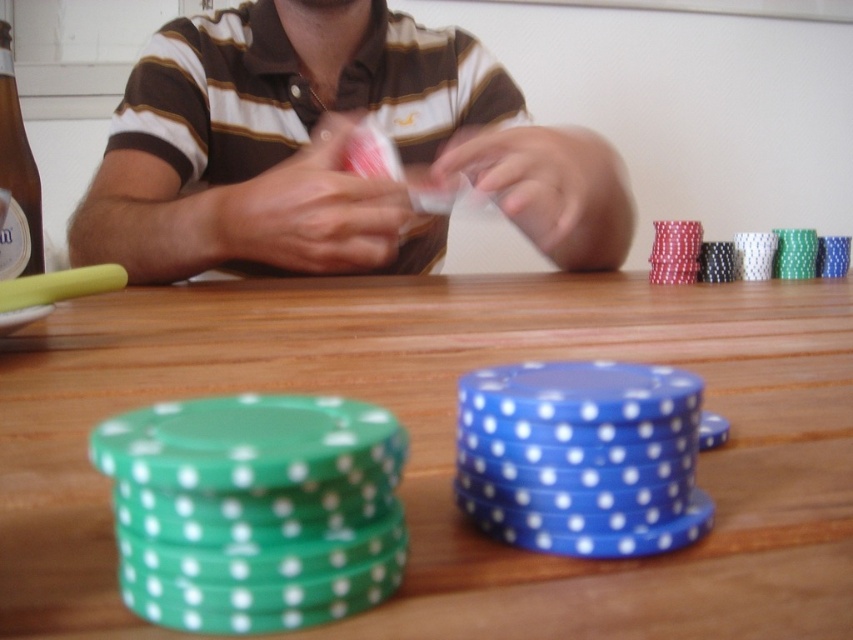
Is green plastic chips at lower left wider than matte brown shirt at upper center?

Correct, the width of green plastic chips at lower left exceeds that of matte brown shirt at upper center.

Is green plastic chips at lower left to the left of matte brown shirt at upper center from the viewer's perspective?

In fact, green plastic chips at lower left is to the right of matte brown shirt at upper center.

Between point (735, 518) and point (456, 49), which one is positioned in front?

Point (735, 518)

Locate an element on the screen. This screenshot has height=640, width=853. green plastic chips at lower left is located at coordinates (453, 444).